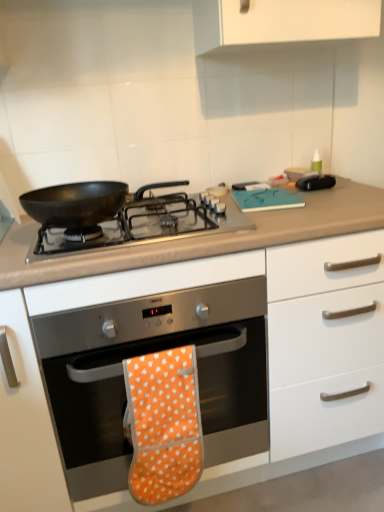
Question: Is matte black pan at center completely or partially inside white matte cabinet at center?

Choices:
 (A) no
 (B) yes

Answer: (A)

Question: Is white matte cabinet at center far from matte black pan at center?

Choices:
 (A) yes
 (B) no

Answer: (B)

Question: Considering the relative sizes of white matte cabinet at center and matte black pan at center in the image provided, is white matte cabinet at center smaller than matte black pan at center?

Choices:
 (A) yes
 (B) no

Answer: (B)

Question: Is white matte cabinet at center at the right side of matte black pan at center?

Choices:
 (A) no
 (B) yes

Answer: (B)

Question: Considering the relative sizes of white matte cabinet at center and matte black pan at center in the image provided, is white matte cabinet at center wider than matte black pan at center?

Choices:
 (A) no
 (B) yes

Answer: (B)

Question: Considering the positions of point (56, 444) and point (253, 225), is point (56, 444) closer or farther from the camera than point (253, 225)?

Choices:
 (A) farther
 (B) closer

Answer: (A)

Question: Is white matte cabinet at center inside or outside of black matte pan at center?

Choices:
 (A) outside
 (B) inside

Answer: (A)

Question: In terms of size, does white matte cabinet at center appear bigger or smaller than black matte pan at center?

Choices:
 (A) big
 (B) small

Answer: (A)

Question: From a real-world perspective, is white matte cabinet at center physically located above or below black matte pan at center?

Choices:
 (A) below
 (B) above

Answer: (A)

Question: From a real-world perspective, is orange fabric oven mitt at center physically located above or below matte black pan at center?

Choices:
 (A) below
 (B) above

Answer: (A)

Question: Is orange fabric oven mitt at center wider or thinner than matte black pan at center?

Choices:
 (A) thin
 (B) wide

Answer: (A)

Question: Considering the positions of orange fabric oven mitt at center and matte black pan at center in the image, is orange fabric oven mitt at center taller or shorter than matte black pan at center?

Choices:
 (A) short
 (B) tall

Answer: (B)

Question: In the image, is orange fabric oven mitt at center positioned in front of or behind matte black pan at center?

Choices:
 (A) front
 (B) behind

Answer: (B)

Question: In the image, is orange fabric oven mitt at center on the left side or the right side of orange fabric oven mitt at center?

Choices:
 (A) right
 (B) left

Answer: (B)

Question: Considering their positions, is orange fabric oven mitt at center located in front of or behind orange fabric oven mitt at center?

Choices:
 (A) behind
 (B) front

Answer: (B)